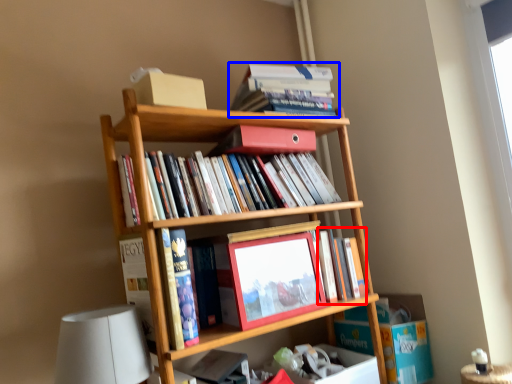
Question: Which of the following is the closest to the observer, book (highlighted by a red box) or book (highlighted by a blue box)?

Choices:
 (A) book
 (B) book

Answer: (A)